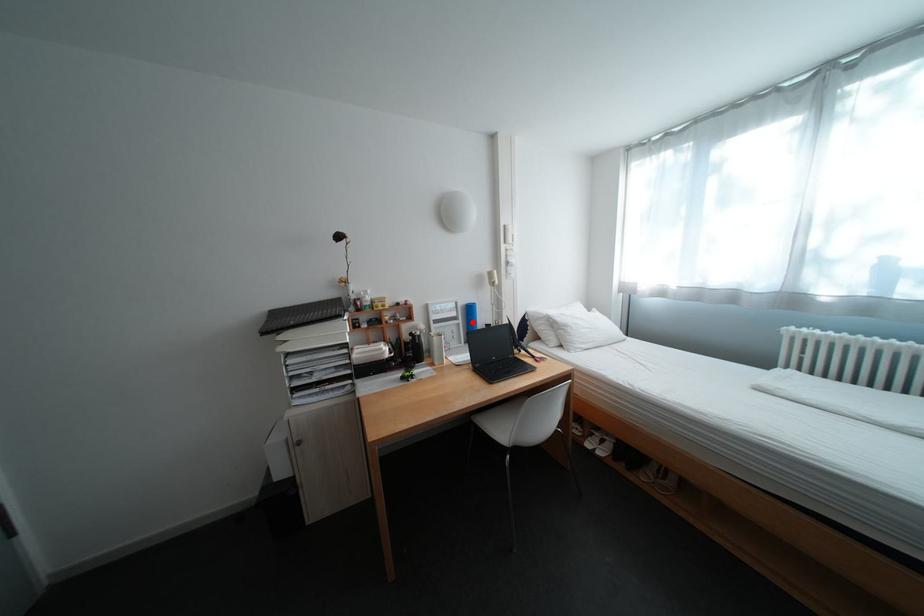
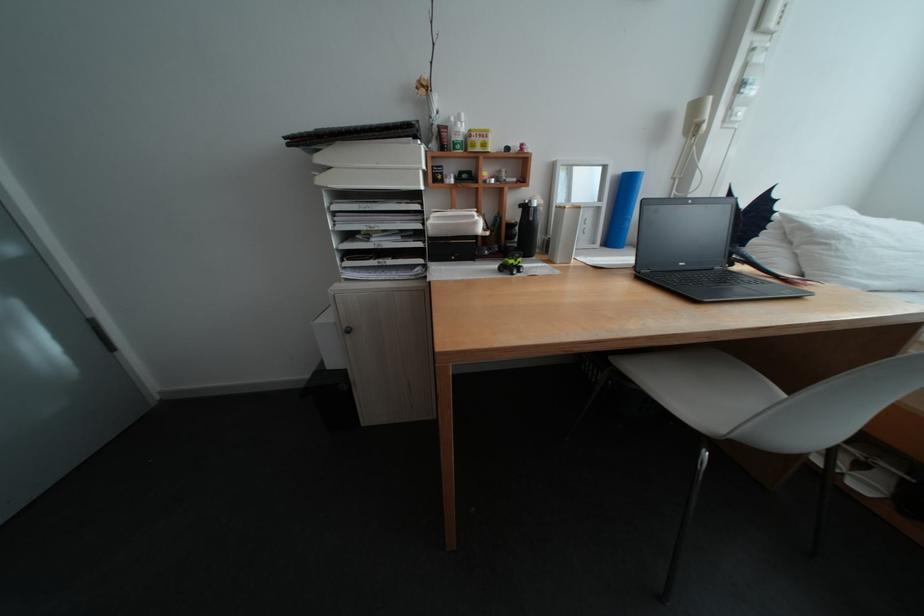
In the second image, find the point that corresponds to the highlighted location in the first image.

(616, 205)